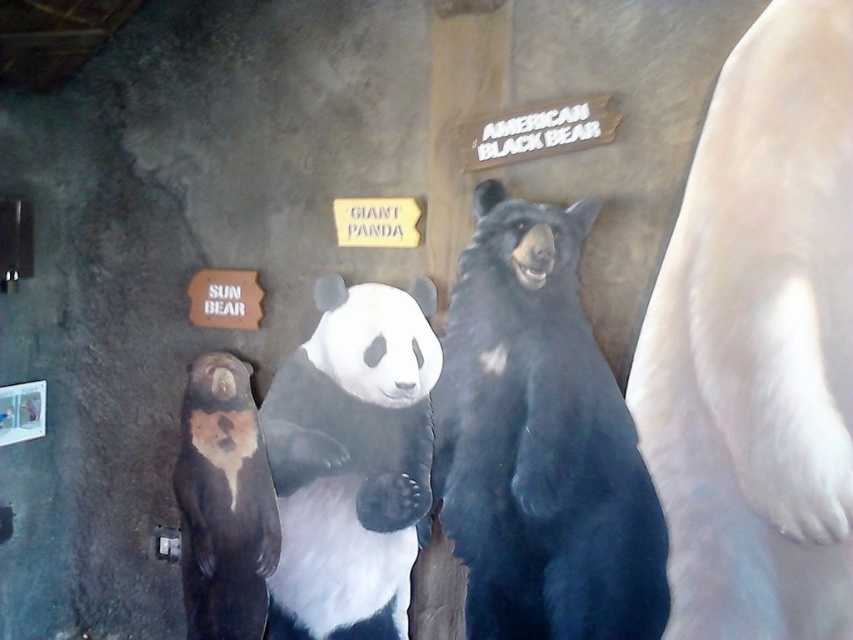
Is point (567, 580) positioned before point (372, 508)?

Yes.

Can you confirm if black furry bear at center is positioned to the right of white matte panda at center?

Indeed, black furry bear at center is positioned on the right side of white matte panda at center.

Which is behind, point (578, 586) or point (268, 628)?

The point (268, 628) is more distant.

You are a GUI agent. You are given a task and a screenshot of the screen. Output one action in this format:
    pyautogui.click(x=<x>, y=<y>)
    Task: Click on the black furry bear at center
    This screenshot has height=640, width=853.
    Given the screenshot: What is the action you would take?
    pyautogui.click(x=540, y=442)

Consider the image. Who is more distant from viewer, (357, 563) or (201, 560)?

The point (201, 560) is behind.

Does point (426, 410) lie in front of point (218, 465)?

No, (426, 410) is further to viewer.

Locate an element on the screen. The image size is (853, 640). white matte panda at center is located at coordinates (351, 461).

Between black furry bear at center and brown matte sun bear at left, which one has less height?

With less height is brown matte sun bear at left.

Based on the photo, does black furry bear at center come in front of brown matte sun bear at left?

Yes, black furry bear at center is closer to the viewer.

Which is behind, point (485, 296) or point (206, 538)?

The point (206, 538) is more distant.

Identify the location of black furry bear at center. (540, 442).